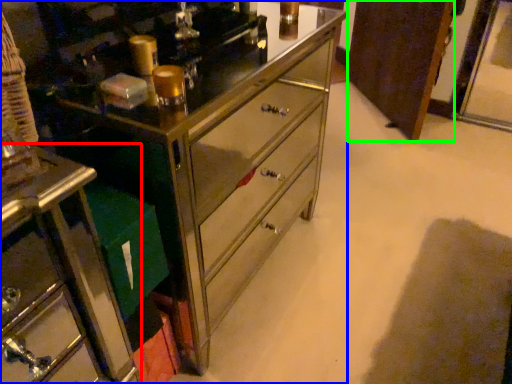
Question: Which is farther away from furniture (highlighted by a red box)? chest of drawers (highlighted by a blue box) or cabinetry (highlighted by a green box)?

Choices:
 (A) chest of drawers
 (B) cabinetry

Answer: (B)